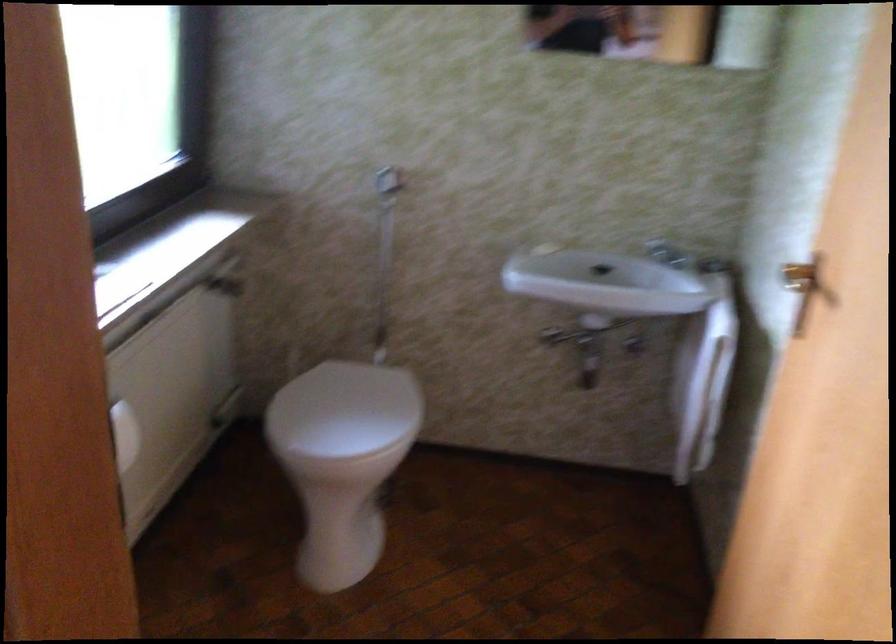
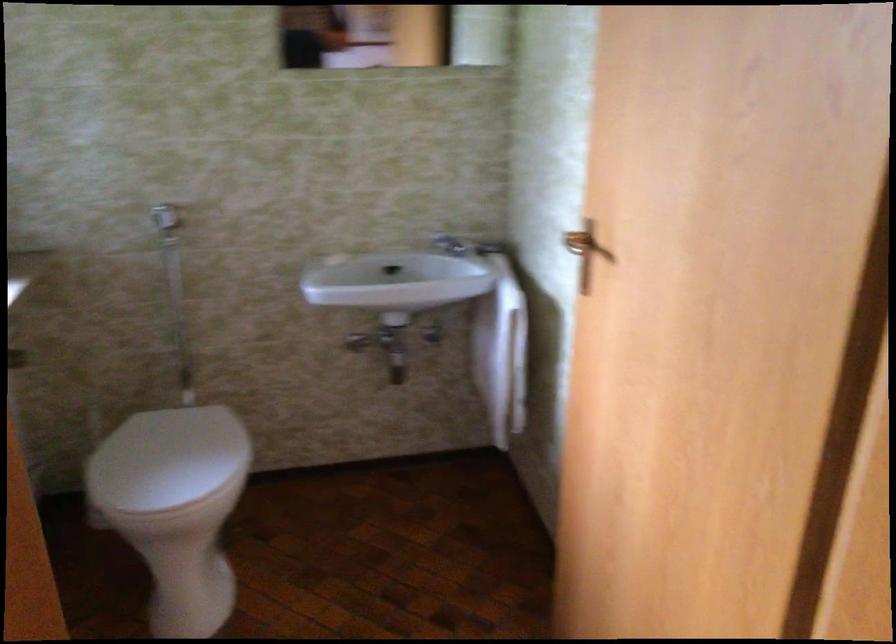
Locate, in the second image, the point that corresponds to (340,410) in the first image.

(167, 460)